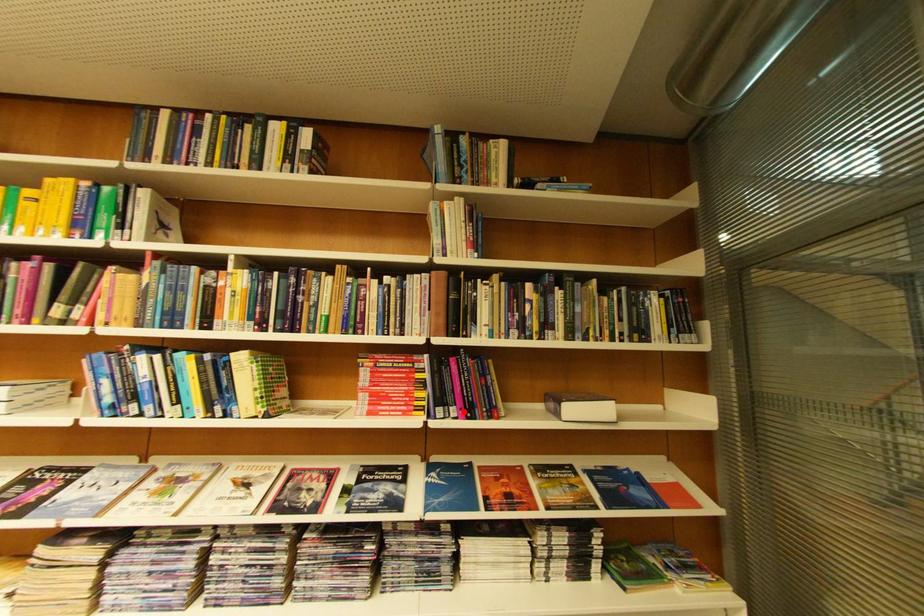
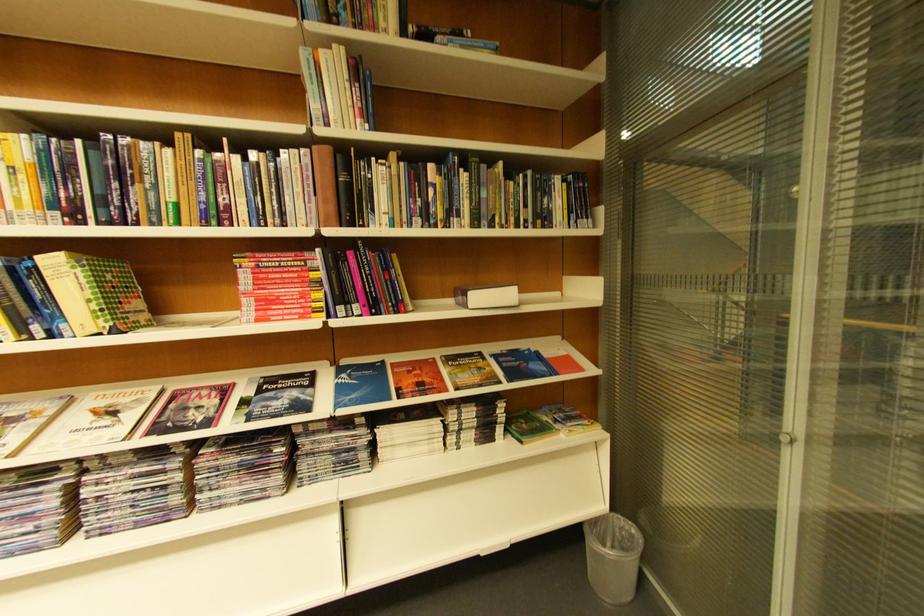
Locate, in the second image, the point that corresponds to the highlighted location in the first image.

(367, 310)